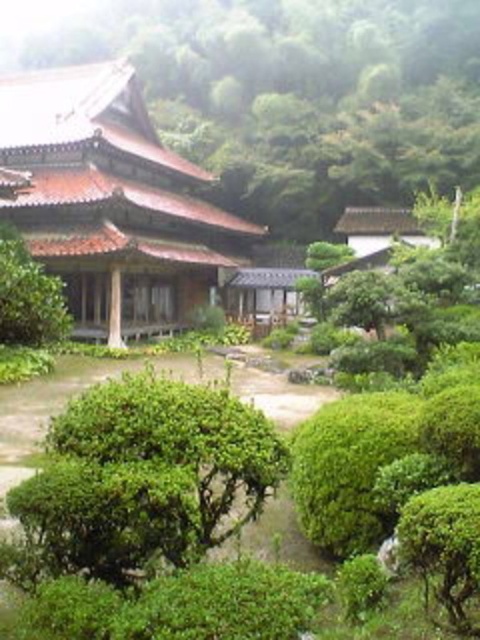
Question: Can you confirm if green leafy tree at upper center is bigger than brown tile roof at center?

Choices:
 (A) yes
 (B) no

Answer: (A)

Question: Among these points, which one is nearest to the camera?

Choices:
 (A) (33, 273)
 (B) (320, 102)
 (C) (167, 298)

Answer: (A)

Question: Which of the following is the farthest from the observer?

Choices:
 (A) (20, 230)
 (B) (458, 8)
 (C) (24, 262)
 (D) (451, 500)

Answer: (B)

Question: Which of the following is the closest to the observer?

Choices:
 (A) (222, 260)
 (B) (460, 579)
 (C) (29, 289)

Answer: (B)

Question: Can you confirm if green leafy tree at upper center is positioned above green leafy bush at center?

Choices:
 (A) no
 (B) yes

Answer: (B)

Question: Can you confirm if brown tile roof at center is smaller than green leafy bush at lower right?

Choices:
 (A) no
 (B) yes

Answer: (A)